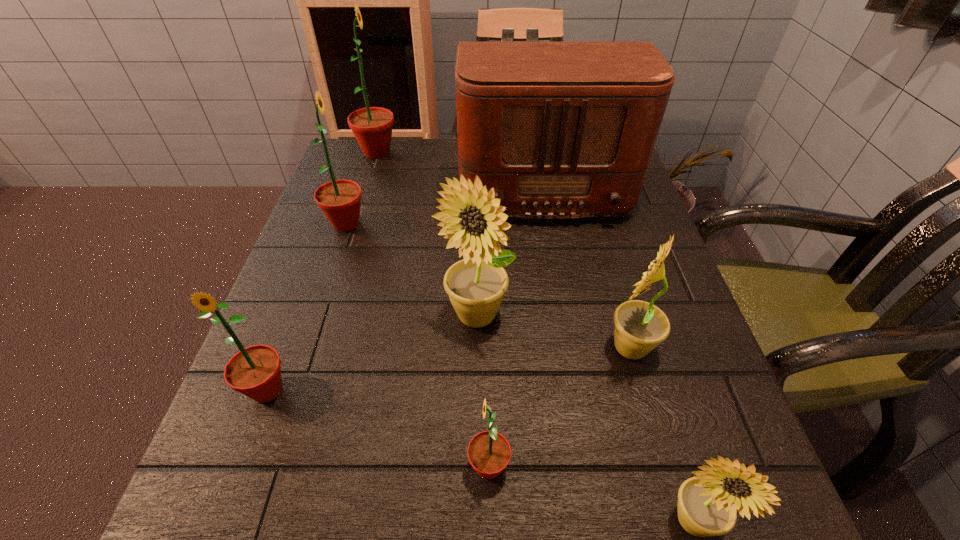
Where is `vacant space situated 0.380m on the face of the farthest sunflower`? The image size is (960, 540). vacant space situated 0.380m on the face of the farthest sunflower is located at coordinates (539, 152).

Image resolution: width=960 pixels, height=540 pixels. Identify the location of free region located on the front panel of the radio receiver. (554, 251).

Identify the location of free space located on the face of the third smallest green sunflower. The width and height of the screenshot is (960, 540). (475, 224).

Find the location of a particular element. Image resolution: width=960 pixels, height=540 pixels. vacant region located 0.150m on the face of the leftmost yellow sunflower is located at coordinates click(474, 424).

Locate an element on the screen. Image resolution: width=960 pixels, height=540 pixels. vacant area situated 0.120m on the face of the second smallest yellow sunflower is located at coordinates (533, 348).

You are a GUI agent. You are given a task and a screenshot of the screen. Output one action in this format:
    pyautogui.click(x=<x>, y=<y>)
    Task: Click on the vacant region located on the face of the second smallest yellow sunflower
    
    Given the screenshot: What is the action you would take?
    pyautogui.click(x=416, y=348)

You are a GUI agent. You are given a task and a screenshot of the screen. Output one action in this format:
    pyautogui.click(x=<x>, y=<y>)
    Task: Click on the vacant space located 0.180m on the face of the second smallest yellow sunflower
    
    Given the screenshot: What is the action you would take?
    pyautogui.click(x=497, y=348)

You are a GUI agent. You are given a task and a screenshot of the screen. Output one action in this format:
    pyautogui.click(x=<x>, y=<y>)
    Task: Click on the vacant space located 0.110m on the face of the third farthest green sunflower
    
    Given the screenshot: What is the action you would take?
    pyautogui.click(x=230, y=489)

Where is `blank space located on the face of the second nearest object`? Image resolution: width=960 pixels, height=540 pixels. blank space located on the face of the second nearest object is located at coordinates (289, 467).

Find the location of `vacant space positioned on the face of the second nearest object`. vacant space positioned on the face of the second nearest object is located at coordinates (310, 467).